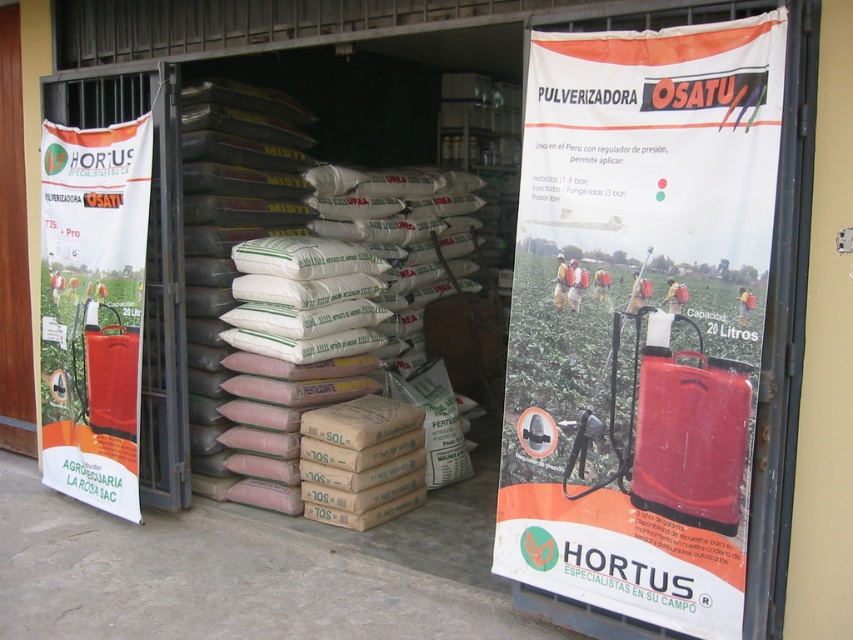
You are standing in the storage area and need to place a new sign between the orange plastic poster at right and the white paper poster at left. The sign is 1.5 meters long. Will there be enough space between them to fit the sign?

The orange plastic poster at right is 2.69 meters away from the white paper poster at left, so yes, the 1.5 meter long sign can fit between them since the distance is greater than the sign length.

Consider the image. You are a customer entering the agricultural supply store and see both the orange plastic poster at right and the white paper poster at left. Which poster is taller?

The orange plastic poster at right is taller than the white paper poster at left.

You are standing in front of the storage area and notice the orange plastic poster at right. Where exactly is this poster positioned relative to the open metal security gate?

The orange plastic poster at right is located at point 0.505 on the x axis and 0.751 on the y axis relative to the open metal security gate.